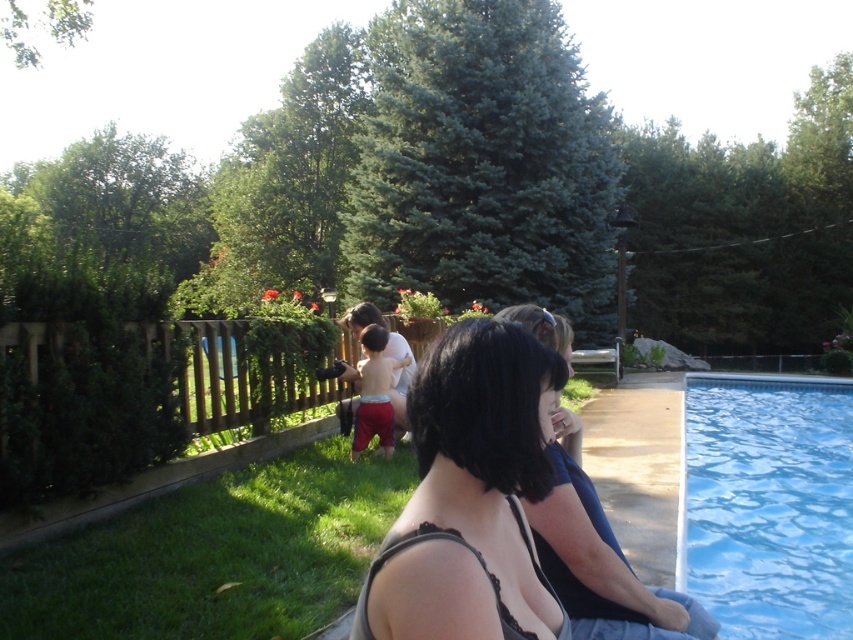
Find the location of a particular element. This screenshot has height=640, width=853. blue smooth water at right is located at coordinates (769, 506).

Is blue smooth water at right to the left of smooth skin girl at center from the viewer's perspective?

No, blue smooth water at right is not to the left of smooth skin girl at center.

Which is behind, point (740, 541) or point (363, 348)?

Positioned behind is point (740, 541).

Find the location of `blue smooth water at right`. blue smooth water at right is located at coordinates (769, 506).

The image size is (853, 640). What are the coordinates of `blue smooth water at right` in the screenshot? It's located at (769, 506).

Does point (772, 580) come closer to viewer compared to point (544, 316)?

No, it is behind (544, 316).

Who is more distant from viewer, (x=769, y=605) or (x=556, y=346)?

Point (x=769, y=605)

Locate an element on the screen. The width and height of the screenshot is (853, 640). blue smooth water at right is located at coordinates [769, 506].

Which of these two, dark gray fabric top at lower right or smooth skin girl at center, stands shorter?

dark gray fabric top at lower right

The width and height of the screenshot is (853, 640). What do you see at coordinates (599, 557) in the screenshot?
I see `dark gray fabric top at lower right` at bounding box center [599, 557].

You are a GUI agent. You are given a task and a screenshot of the screen. Output one action in this format:
    pyautogui.click(x=<x>, y=<y>)
    Task: Click on the dark gray fabric top at lower right
    The image size is (853, 640).
    Given the screenshot: What is the action you would take?
    [x=599, y=557]